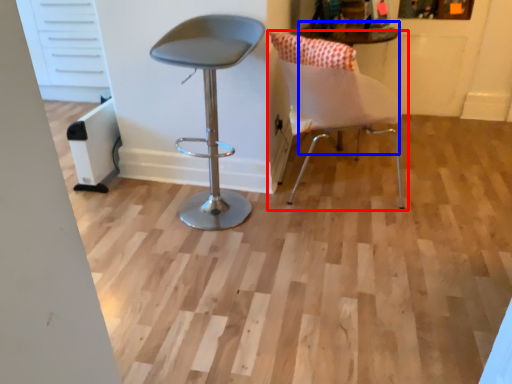
Question: Which point is further to the camera, chair (highlighted by a red box) or round table (highlighted by a blue box)?

Choices:
 (A) chair
 (B) round table

Answer: (A)